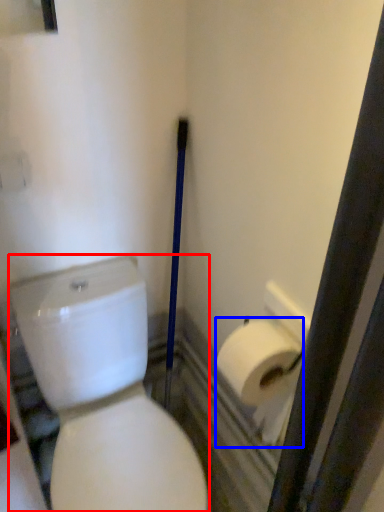
Question: Which object appears closest to the camera in this image, porcelain (highlighted by a red box) or toilet paper (highlighted by a blue box)?

Choices:
 (A) porcelain
 (B) toilet paper

Answer: (A)